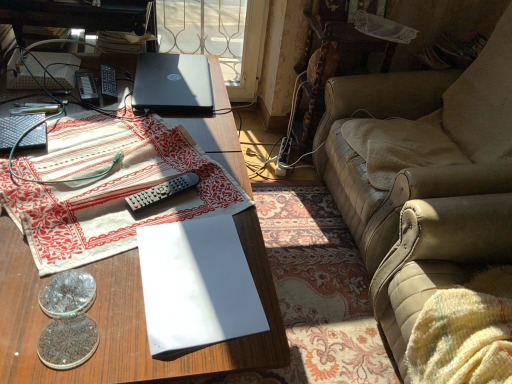
This screenshot has width=512, height=384. I want to click on free space between satin black laptop at upper center and translucent glass coins at lower left, the first coin viewed from the front, so click(138, 171).